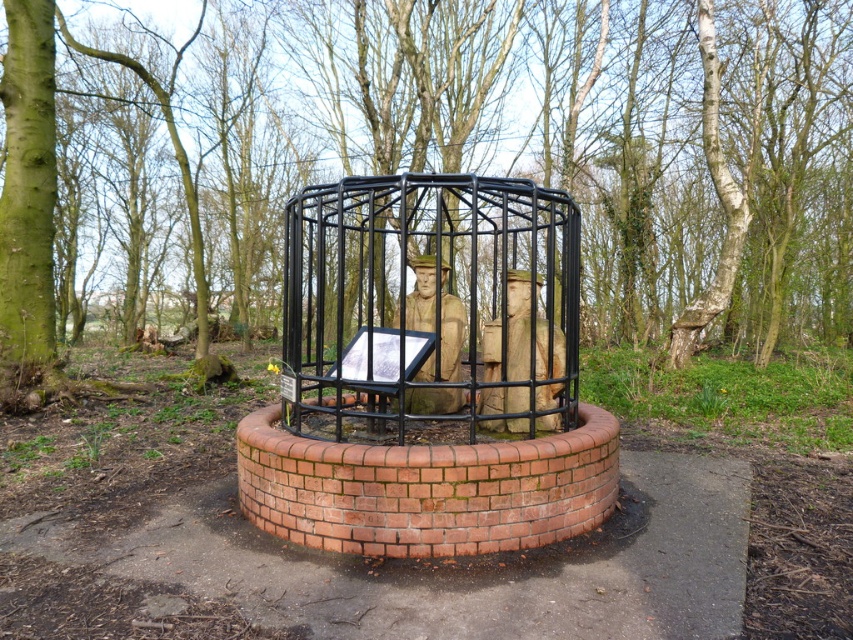
Measure the distance from green bark tree at center to black metal cage at center.

A distance of 4.85 meters exists between green bark tree at center and black metal cage at center.

Looking at this image, which is above, green bark tree at center or black metal cage at center?

Positioned higher is green bark tree at center.

Is point (73, 321) behind point (422, 432)?

Yes, point (73, 321) is behind point (422, 432).

This screenshot has height=640, width=853. I want to click on green bark tree at center, so click(x=485, y=148).